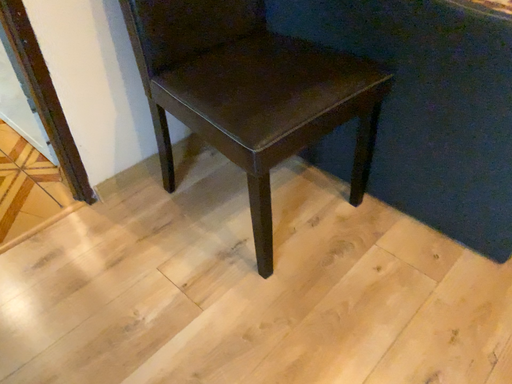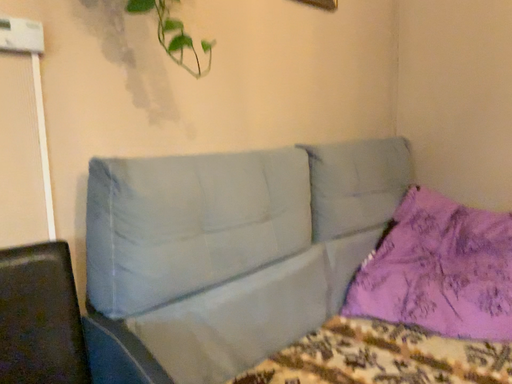
Question: How did the camera likely rotate when shooting the video?

Choices:
 (A) rotated upward
 (B) rotated downward

Answer: (A)